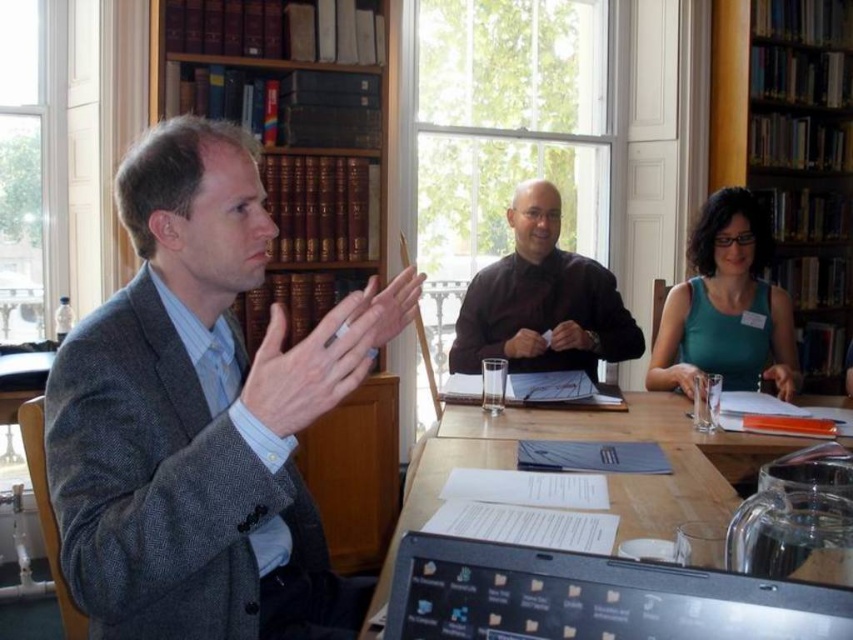
Who is more distant from viewer, (498, 449) or (659, 356)?

Point (659, 356)

Who is more distant from viewer, [704,460] or [787,358]?

The point [787,358] is behind.

This screenshot has height=640, width=853. What are the coordinates of `wooden table at center` in the screenshot? It's located at (606, 474).

Can you confirm if black glossy laptop at lower center is bigger than black matte shirt at center?

No, black glossy laptop at lower center is not bigger than black matte shirt at center.

Is point (735, 586) less distant than point (599, 308)?

Yes, point (735, 586) is in front of point (599, 308).

Where is `black glossy laptop at lower center`? black glossy laptop at lower center is located at coordinates (593, 596).

Who is lower down, wooden table at center or black matte shirt at center?

wooden table at center

Does wooden table at center have a greater height compared to black matte shirt at center?

In fact, wooden table at center may be shorter than black matte shirt at center.

Does point (482, 436) come closer to viewer compared to point (624, 352)?

Yes, it is in front of point (624, 352).

Locate an element on the screen. The height and width of the screenshot is (640, 853). wooden table at center is located at coordinates (606, 474).